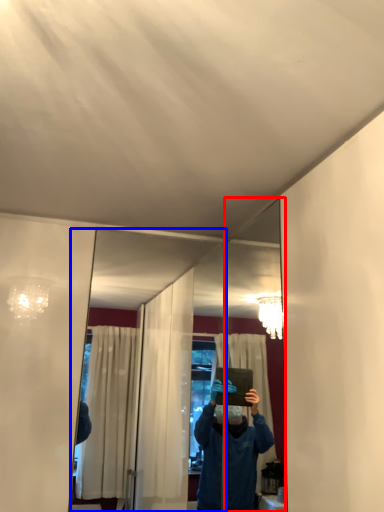
Question: Which point is further to the camera, mirror (highlighted by a red box) or mirror (highlighted by a blue box)?

Choices:
 (A) mirror
 (B) mirror

Answer: (B)